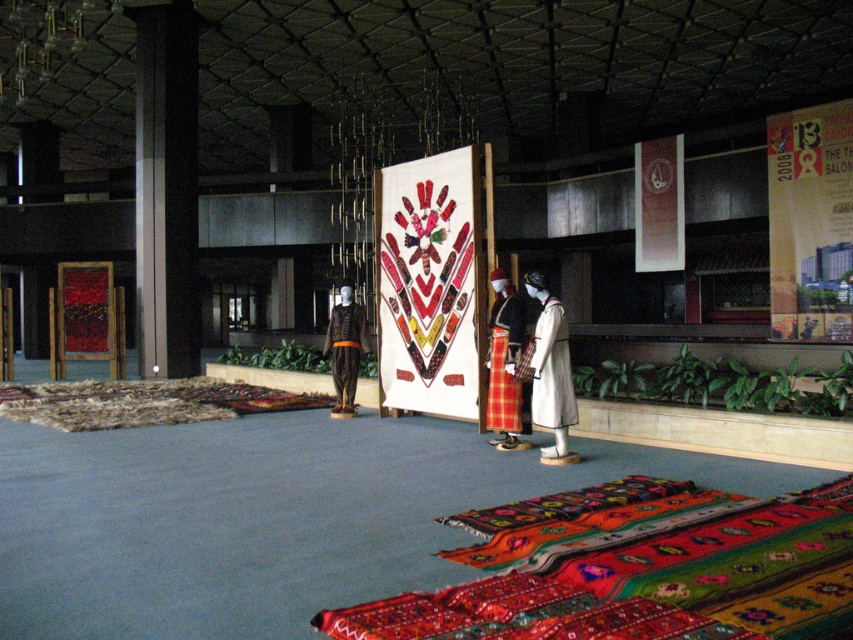
Based on the photo, you are a visitor at the exhibition and want to take a photo of the multicolored woven rug at center and the matte black robe at center. Which object should you focus on first if you want to capture both in one shot without moving the camera?

The multicolored woven rug at center is shorter than the matte black robe at center, so you should focus on the matte black robe at center first to ensure both are in focus.

You are an interior designer planning to place a new sofa in this exhibition space. The sofa will be positioned near the vibrant woven rug at lower center and the white matte robe at center. Which object should you consider in terms of size when ensuring the sofa doesn t overwhelm the space?

The vibrant woven rug at lower center is larger in size than the white matte robe at center, so you should consider the size of the vibrant woven rug at lower center to ensure the sofa doesn t overwhelm the space.

You are standing in the exhibition space and want to take a photo of the two points marked in the image. Which point, point (x=793, y=586) or point (x=292, y=406), will appear larger in your camera view?

Point (x=793, y=586) is closer to the camera than point (x=292, y=406), so it will appear larger in the camera view.